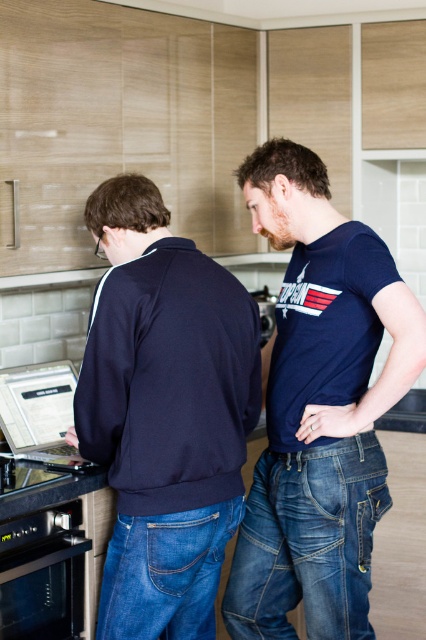
Can you confirm if navy blue sweatshirt at left is positioned to the right of silver metallic laptop at left?

Yes, navy blue sweatshirt at left is to the right of silver metallic laptop at left.

Does navy blue sweatshirt at left appear over silver metallic laptop at left?

Yes, navy blue sweatshirt at left is above silver metallic laptop at left.

Which is in front, point (152, 556) or point (28, 372)?

Point (152, 556)

Locate an element on the screen. The image size is (426, 640). navy blue sweatshirt at left is located at coordinates (164, 413).

Is dark blue t-shirt at center above silver metallic laptop at left?

Yes, dark blue t-shirt at center is above silver metallic laptop at left.

Looking at this image, does dark blue t-shirt at center have a smaller size compared to silver metallic laptop at left?

Incorrect, dark blue t-shirt at center is not smaller in size than silver metallic laptop at left.

This screenshot has width=426, height=640. I want to click on dark blue t-shirt at center, so click(x=319, y=406).

How distant is dark blue t-shirt at center from black stainless steel oven at lower left?

They are 31.03 inches apart.

Between dark blue t-shirt at center and black stainless steel oven at lower left, which one is positioned lower?

black stainless steel oven at lower left is below.

Describe the element at coordinates (319, 406) in the screenshot. I see `dark blue t-shirt at center` at that location.

The width and height of the screenshot is (426, 640). Find the location of `dark blue t-shirt at center`. dark blue t-shirt at center is located at coordinates (319, 406).